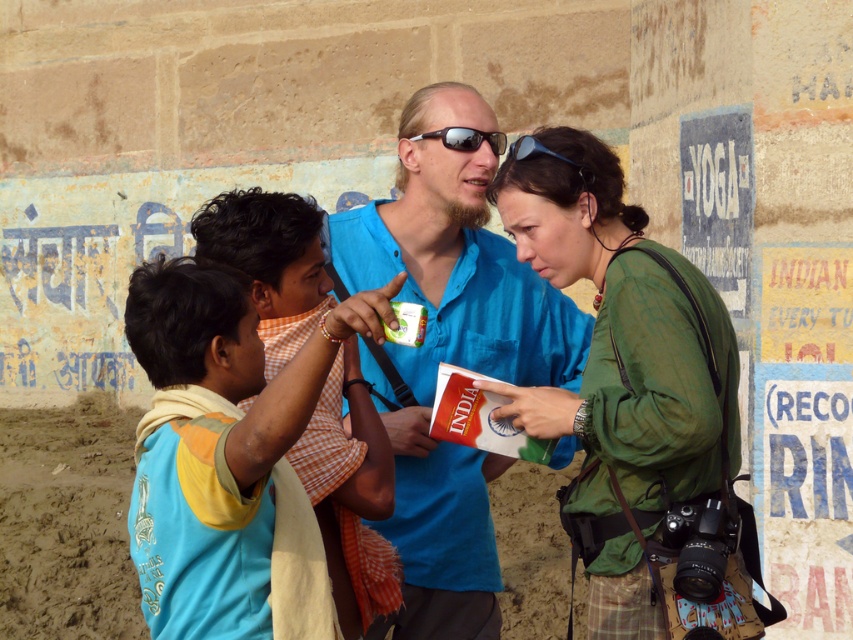
Consider the image. You are a photographer trying to capture a candid shot of the group. You notice the blue cotton shirt at lower left and the sunglasses at center. Which object should you focus on first to ensure it appears sharp in the photo?

The blue cotton shirt at lower left should be focused on first because it is in front of the sunglasses at center, making it closer to the camera.

You are standing in front of the group of four individuals in the image. There are two points marked in the scene. Which of the two points, point (299, 356) or point (451, 147), is closer to you?

Point (299, 356) is closer to the viewer than point (451, 147).